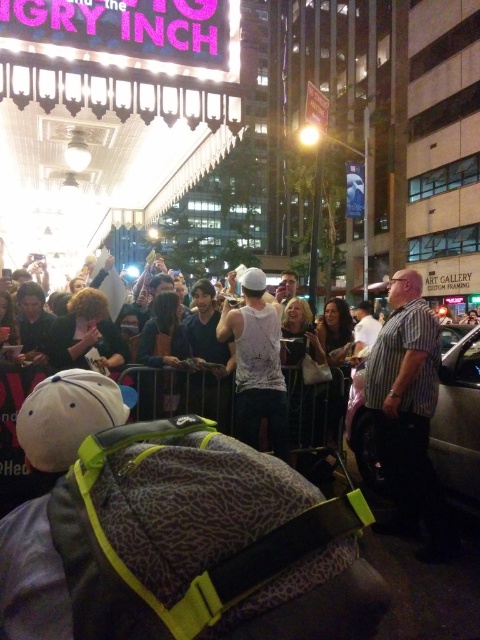
Question: Which is farther from the silver metallic car at center-right?

Choices:
 (A) striped cotton shirt at center
 (B) white cotton tank top at center

Answer: (B)

Question: Which point is farther to the camera?

Choices:
 (A) silver metallic car at center-right
 (B) white cotton tank top at center

Answer: (B)

Question: Is striped cotton shirt at center below white cotton tank top at center?

Choices:
 (A) no
 (B) yes

Answer: (A)

Question: Can you confirm if striped cotton shirt at center is positioned below silver metallic car at center-right?

Choices:
 (A) yes
 (B) no

Answer: (A)

Question: Considering the real-world distances, which object is farthest from the striped cotton shirt at center?

Choices:
 (A) white cotton tank top at center
 (B) silver metallic car at center-right

Answer: (A)

Question: From the image, what is the correct spatial relationship of striped cotton shirt at center in relation to white cotton tank top at center?

Choices:
 (A) above
 (B) below

Answer: (A)